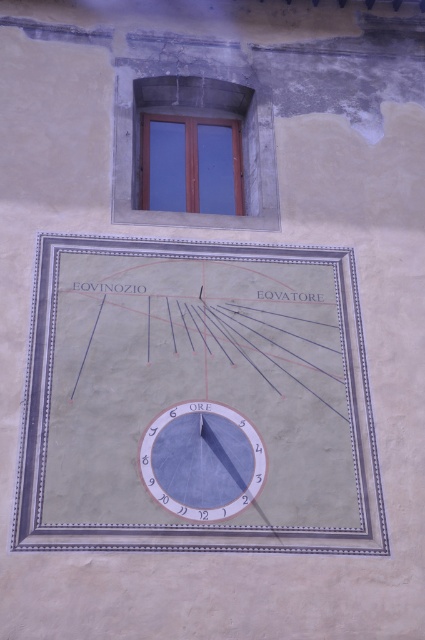
Is matte gray clock at center bigger than wooden window at upper center?

Actually, matte gray clock at center might be smaller than wooden window at upper center.

Is point (190, 513) behind point (234, 106)?

No, (190, 513) is in front of (234, 106).

Identify the location of matte gray clock at center. Image resolution: width=425 pixels, height=640 pixels. (201, 460).